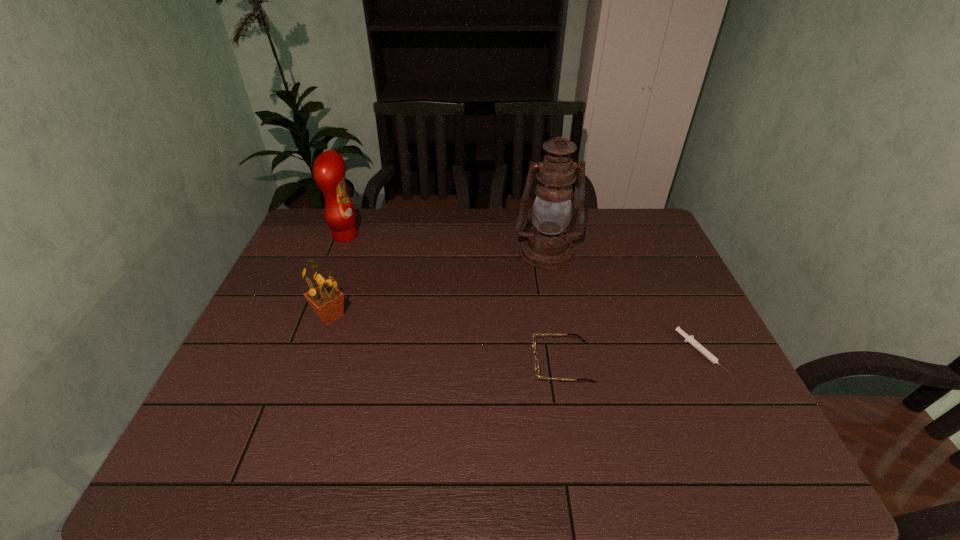
This screenshot has height=540, width=960. Find the location of `free point that satisfies the following two spatial constraints: 1. on the label side of the fourth shortest object; 2. on the back side of the shortest object`. free point that satisfies the following two spatial constraints: 1. on the label side of the fourth shortest object; 2. on the back side of the shortest object is located at coordinates (300, 353).

Identify the location of free space that satisfies the following two spatial constraints: 1. at the front of the shortest object with flowers visible; 2. on the left side of the sunflower. (317, 353).

Where is `vacant space that satisfies the following two spatial constraints: 1. on the label side of the condiment; 2. on the back side of the syringe`? Image resolution: width=960 pixels, height=540 pixels. vacant space that satisfies the following two spatial constraints: 1. on the label side of the condiment; 2. on the back side of the syringe is located at coordinates pyautogui.click(x=300, y=353).

Where is `free spot that satisfies the following two spatial constraints: 1. on the back side of the tallest object; 2. on the label side of the condiment`? This screenshot has height=540, width=960. free spot that satisfies the following two spatial constraints: 1. on the back side of the tallest object; 2. on the label side of the condiment is located at coordinates (543, 235).